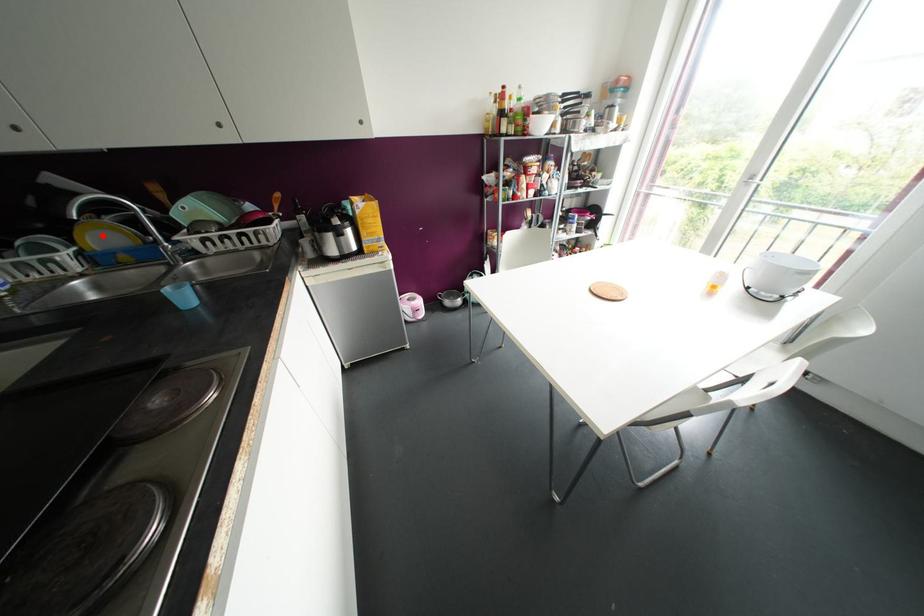
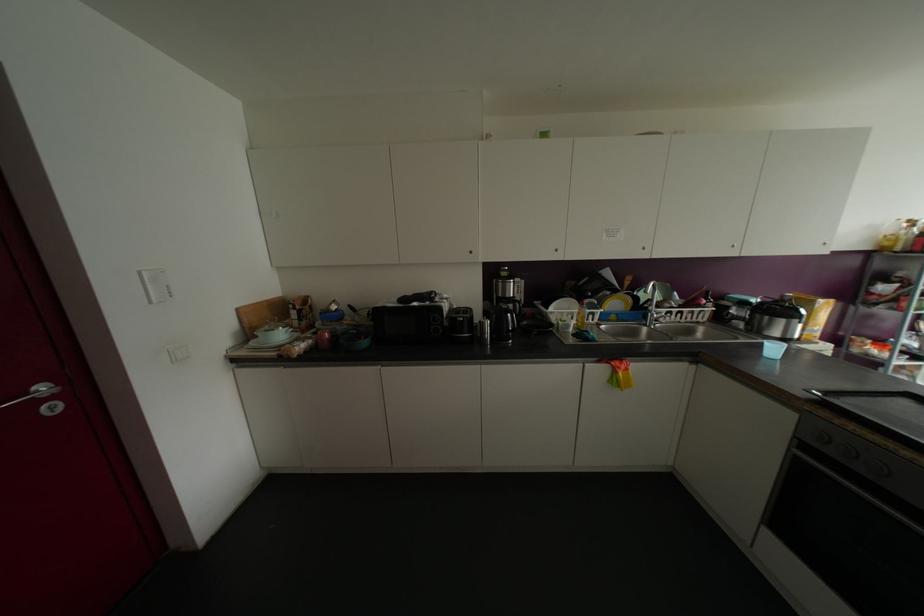
The point at the highlighted location is marked in the first image. Where is the corresponding point in the second image?

(614, 302)